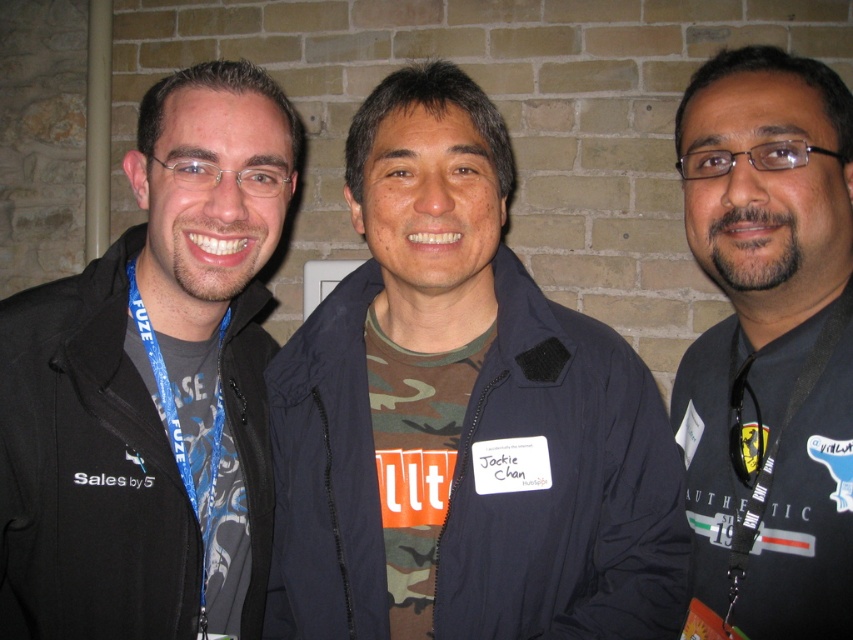
Does camo fabric shirt at center have a lesser height compared to black fabric shirt at center?

In fact, camo fabric shirt at center may be taller than black fabric shirt at center.

In the scene shown: Does camo fabric shirt at center have a smaller size compared to black fabric shirt at center?

No.

Locate an element on the screen. The width and height of the screenshot is (853, 640). camo fabric shirt at center is located at coordinates (463, 416).

Find the location of a particular element. The image size is (853, 640). camo fabric shirt at center is located at coordinates (463, 416).

Is black fabric shirt at center above black fabric lanyard at right?

Yes.

Is point (756, 259) farther from viewer compared to point (735, 330)?

No.

Is point (712, 106) positioned in front of point (732, 336)?

That is True.

You are a GUI agent. You are given a task and a screenshot of the screen. Output one action in this format:
    pyautogui.click(x=<x>, y=<y>)
    Task: Click on the black fabric shirt at center
    This screenshot has height=640, width=853.
    Given the screenshot: What is the action you would take?
    pyautogui.click(x=769, y=342)

Does black matte jacket at left have a greater height compared to black fabric lanyard at right?

Yes.

Who is more distant from viewer, (213, 170) or (770, 465)?

Positioned behind is point (213, 170).

Locate an element on the screen. The width and height of the screenshot is (853, 640). black matte jacket at left is located at coordinates 152,385.